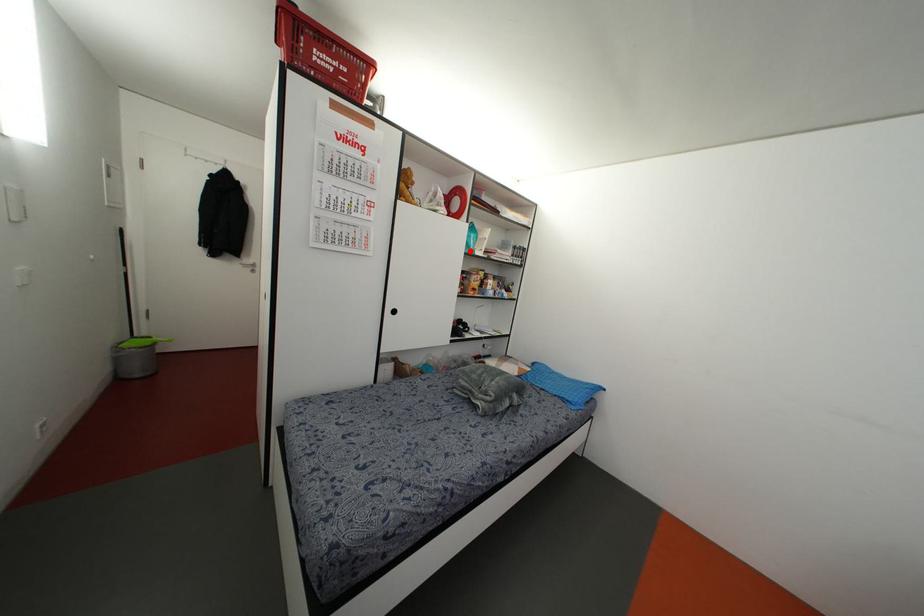
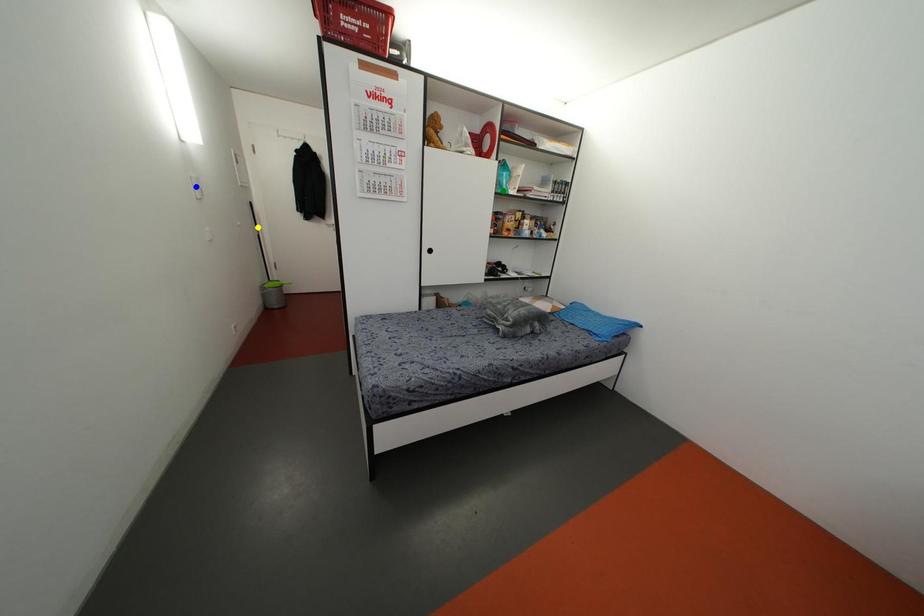
Question: I am providing you with two images of the same scene from different viewpoints. A red point is marked on the first image. You are given multiple points on the second image. Can you choose the point in image 2 that corresponds to the point in image 1?

Choices:
 (A) yellow point
 (B) green point
 (C) blue point

Answer: (B)